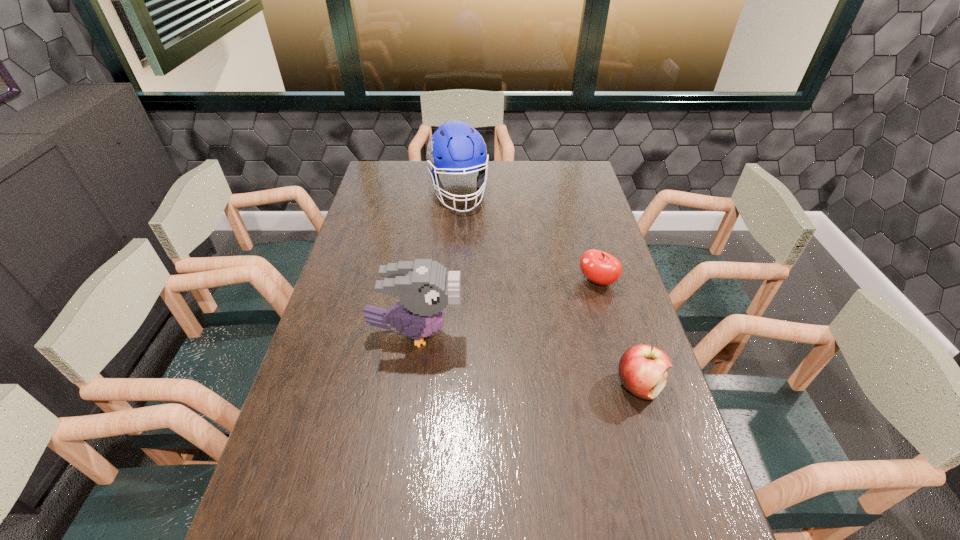
The height and width of the screenshot is (540, 960). What are the coordinates of `vacant region located on the stem of the third nearest object` in the screenshot? It's located at (521, 346).

Locate an element on the screen. The width and height of the screenshot is (960, 540). free location located 0.180m on the stem of the third nearest object is located at coordinates (550, 321).

Locate an element on the screen. This screenshot has width=960, height=540. vacant position located 0.360m on the stem of the third nearest object is located at coordinates (510, 356).

The width and height of the screenshot is (960, 540). Find the location of `object present at the far edge`. object present at the far edge is located at coordinates (455, 147).

The height and width of the screenshot is (540, 960). I want to click on object at the left edge, so click(x=424, y=287).

The height and width of the screenshot is (540, 960). In order to click on free space at the far edge of the desktop in this screenshot , I will do [x=516, y=179].

In the image, there is a desktop. At what (x,y) coordinates should I click in order to perform the action: click on vacant area at the near edge. Please return your answer as a coordinate pair (x, y). The image size is (960, 540). Looking at the image, I should click on (504, 521).

Where is `vacant region at the left edge of the desktop`? Image resolution: width=960 pixels, height=540 pixels. vacant region at the left edge of the desktop is located at coordinates (360, 271).

I want to click on vacant space at the right edge of the desktop, so (589, 212).

Find the location of a particular element. The image size is (960, 540). free space at the far left corner is located at coordinates (399, 178).